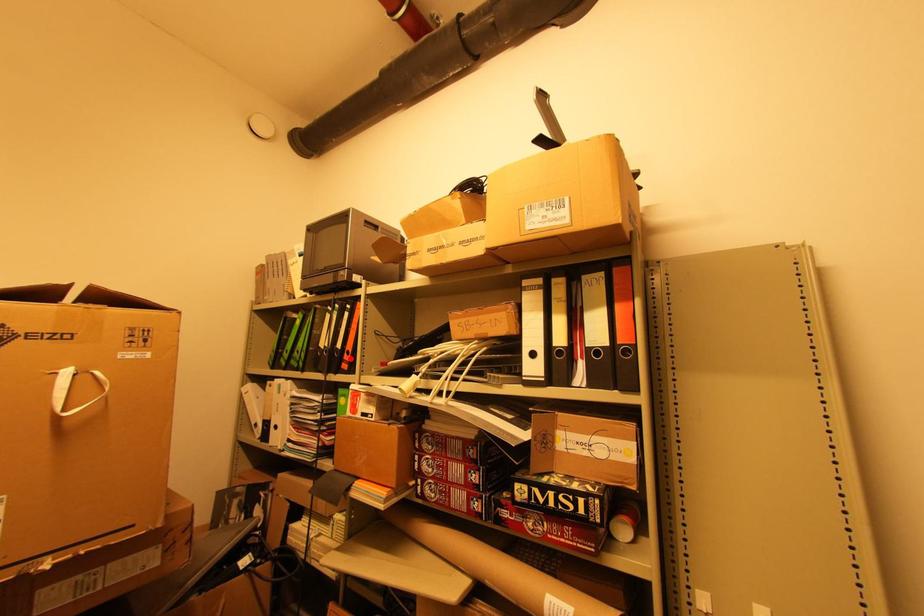
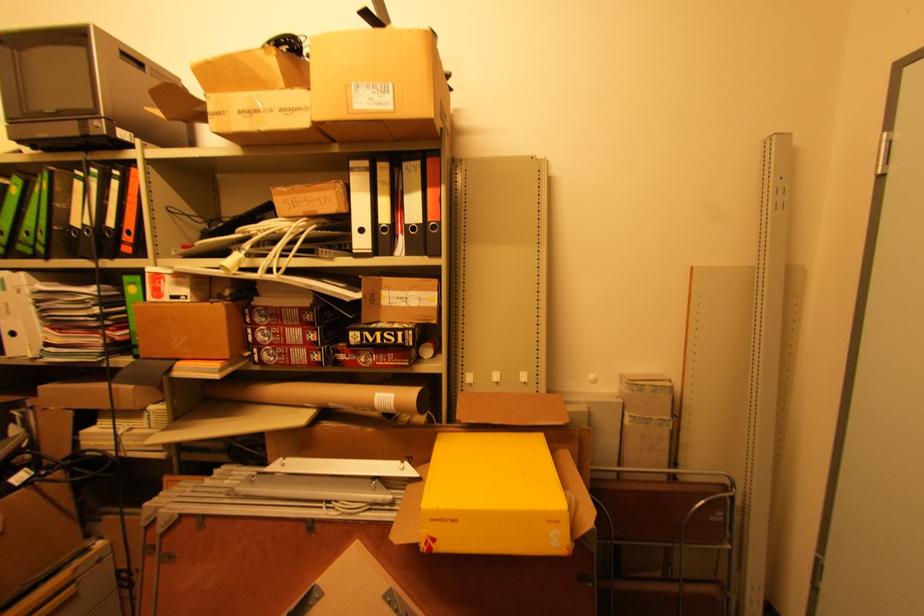
Question: I am providing you with two images of the same scene from different viewpoints. A red point is marked on the first image. Is the red point's position out of view in image 2?

Choices:
 (A) Yes
 (B) No

Answer: (B)